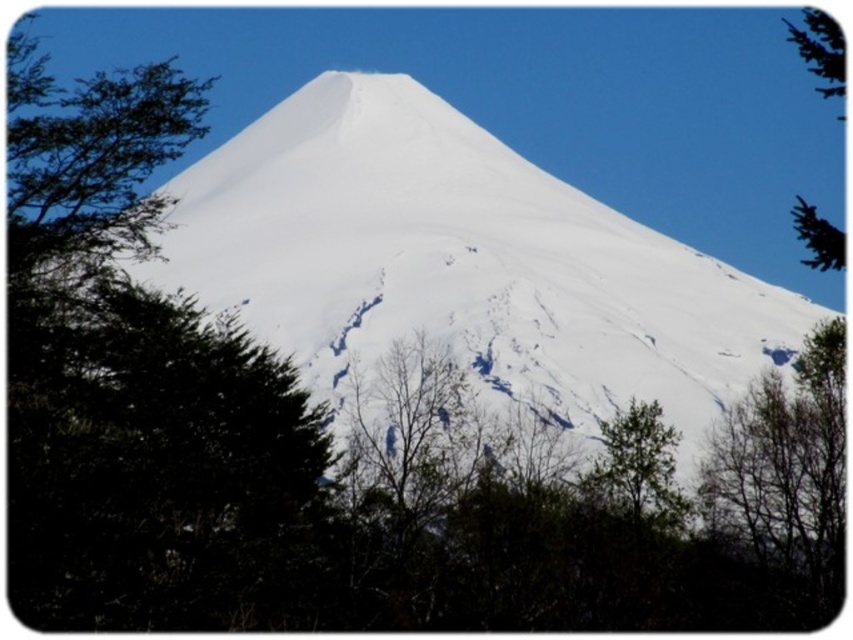
Question: Among these points, which one is farthest from the camera?

Choices:
 (A) (807, 209)
 (B) (682, 333)
 (C) (672, 456)

Answer: (B)

Question: Is green leafy tree at lower right further to camera compared to green leafy tree at upper right?

Choices:
 (A) no
 (B) yes

Answer: (B)

Question: Which is farther from the white snow-covered mountain at center?

Choices:
 (A) green leafy tree at upper right
 (B) green leafy tree at lower right

Answer: (A)

Question: Is the position of green leafy tree at lower right less distant than that of green leafy tree at upper right?

Choices:
 (A) no
 (B) yes

Answer: (A)

Question: Which object is closer to the camera taking this photo?

Choices:
 (A) green leafy tree at upper right
 (B) green leafy tree at lower right

Answer: (A)

Question: Is white snow-covered mountain at center positioned before green leafy tree at lower right?

Choices:
 (A) no
 (B) yes

Answer: (B)